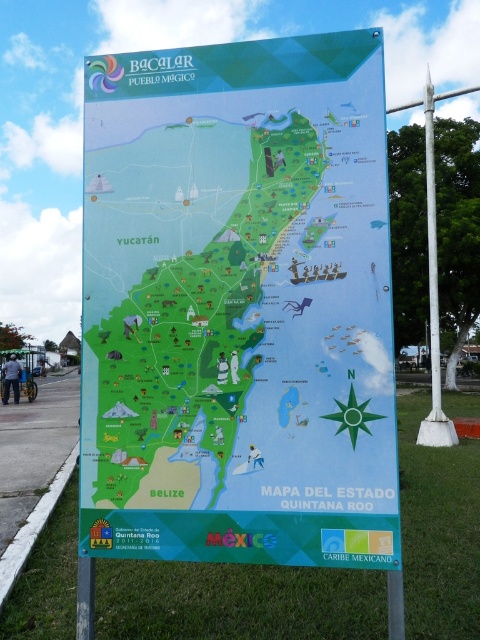
How distant is green paper map at center from white metallic pole at right?

8.53 meters

From the picture: Does green paper map at center appear over white metallic pole at right?

No.

Who is more distant from viewer, (251, 250) or (432, 348)?

The point (432, 348) is behind.

Where is `green paper map at center`? green paper map at center is located at coordinates (239, 305).